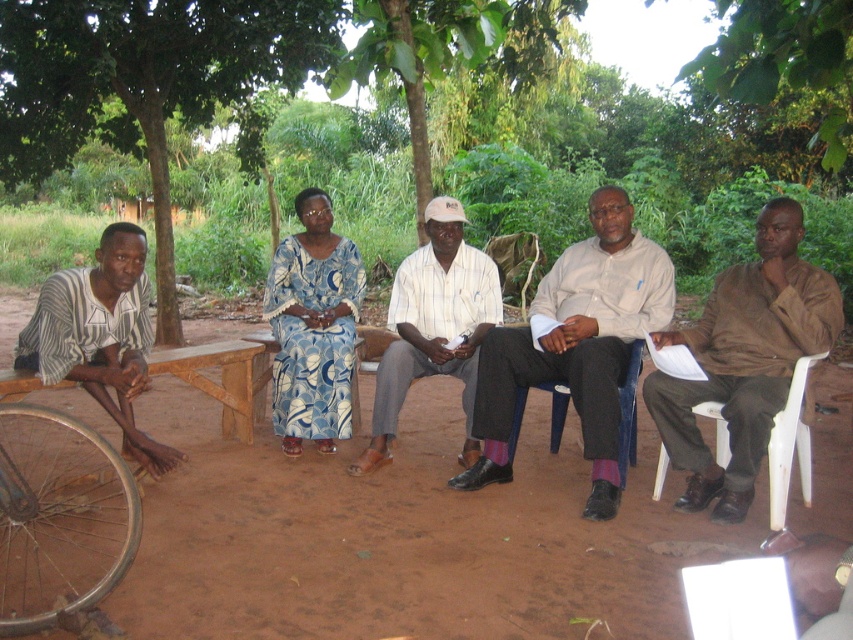
Question: Which point is closer to the camera taking this photo?

Choices:
 (A) (799, 451)
 (B) (248, 580)
 (C) (622, 429)

Answer: (B)

Question: Observing the image, what is the correct spatial positioning of green leafy tree at center in reference to light beige shirt at center?

Choices:
 (A) below
 (B) above

Answer: (B)

Question: Which object is closer to the camera taking this photo?

Choices:
 (A) green leafy tree at center
 (B) striped fabric shirt at left
 (C) brown dirt field at lower center

Answer: (C)

Question: Which is farther from the striped fabric shirt at left?

Choices:
 (A) green leafy tree at center
 (B) blue printed dress at center

Answer: (A)

Question: Is brown dirt field at lower center to the left of blue plastic chair at center from the viewer's perspective?

Choices:
 (A) no
 (B) yes

Answer: (B)

Question: Is brown dirt field at lower center bigger than white plastic chair at right?

Choices:
 (A) no
 (B) yes

Answer: (A)